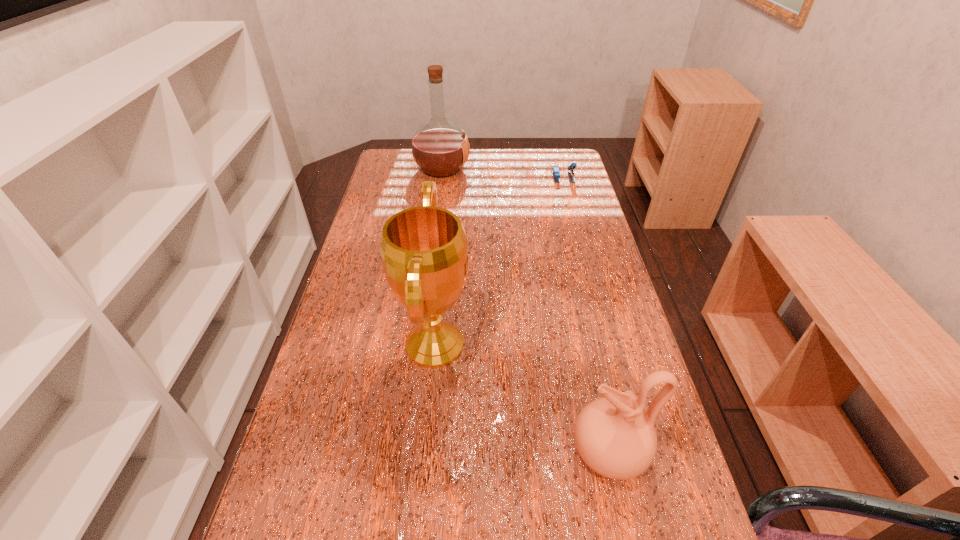
Locate an element on the screen. This screenshot has height=540, width=960. liquor is located at coordinates (440, 148).

Where is `the second nearest object`? This screenshot has width=960, height=540. the second nearest object is located at coordinates (424, 249).

Image resolution: width=960 pixels, height=540 pixels. What are the coordinates of `the second shortest object` in the screenshot? It's located at (615, 438).

I want to click on the nearest object, so click(615, 438).

At what (x,y) coordinates should I click in order to perform the action: click on stapler. Please return your answer as a coordinate pair (x, y). Looking at the image, I should click on (556, 174).

Where is `free space located on the front label of the liquor`? The image size is (960, 540). free space located on the front label of the liquor is located at coordinates (562, 168).

Where is `blank area located on the front-facing side of the third farthest object`? This screenshot has width=960, height=540. blank area located on the front-facing side of the third farthest object is located at coordinates (607, 345).

You are a GUI agent. You are given a task and a screenshot of the screen. Output one action in this format:
    pyautogui.click(x=<x>, y=<y>)
    Task: Click on the free space located on the spout of the nearest object
    
    Given the screenshot: What is the action you would take?
    545,453

Locate an element on the screen. The height and width of the screenshot is (540, 960). free space located on the spout of the nearest object is located at coordinates (500, 453).

Image resolution: width=960 pixels, height=540 pixels. I want to click on vacant space located on the spout of the nearest object, so click(x=379, y=453).